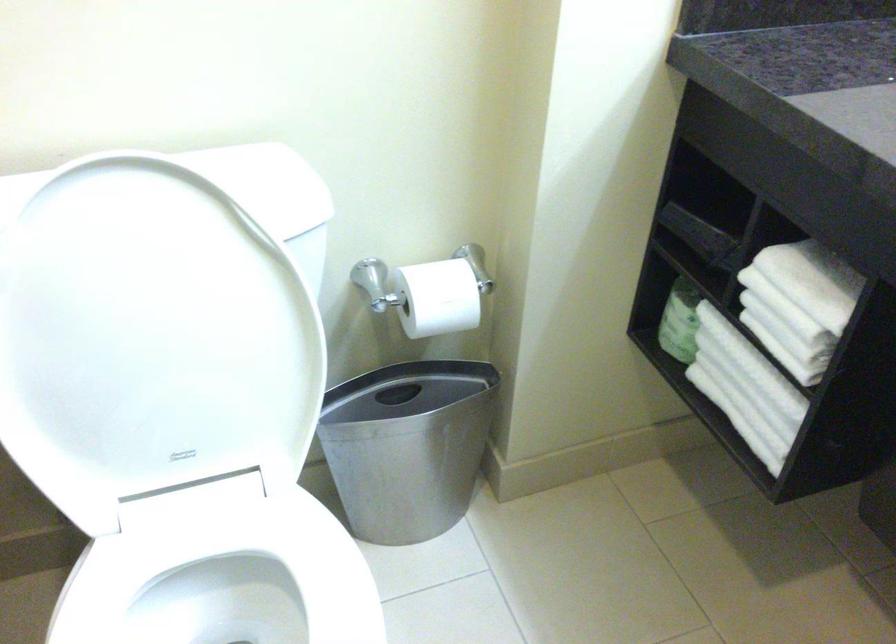
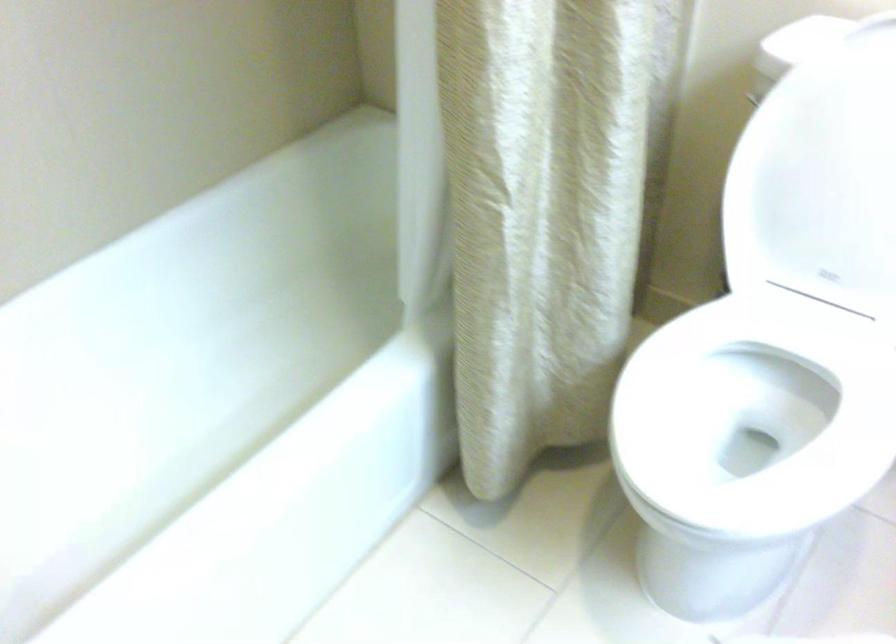
Find the pixel in the second image that matches the point at 121,368 in the first image.

(821, 178)